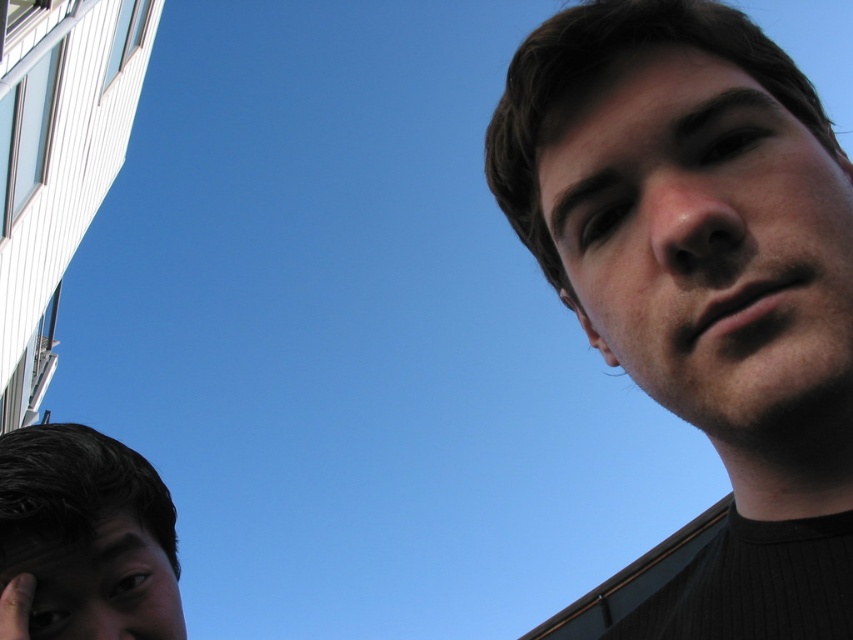
Is smooth skin face at lower left to the right of smooth skin hand at lower left from the viewer's perspective?

Correct, you'll find smooth skin face at lower left to the right of smooth skin hand at lower left.

Which is behind, point (38, 618) or point (4, 618)?

Positioned behind is point (38, 618).

The width and height of the screenshot is (853, 640). I want to click on smooth skin face at lower left, so point(91,586).

Between point (132, 540) and point (564, 285), which one is positioned in front?

Positioned in front is point (132, 540).

Is point (16, 589) positioned before point (570, 296)?

Yes, point (16, 589) is closer to viewer.

Identify the location of smooth skin face at lower left. The height and width of the screenshot is (640, 853). (91, 586).

Which is below, smooth skin face at upper right or matte skin ear at upper right?

Positioned lower is matte skin ear at upper right.

Based on the photo, is the position of smooth skin face at upper right more distant than that of matte skin ear at upper right?

No, smooth skin face at upper right is in front of matte skin ear at upper right.

You are a GUI agent. You are given a task and a screenshot of the screen. Output one action in this format:
    pyautogui.click(x=<x>, y=<y>)
    Task: Click on the smooth skin face at upper right
    This screenshot has width=853, height=640.
    Given the screenshot: What is the action you would take?
    pyautogui.click(x=706, y=241)

Image resolution: width=853 pixels, height=640 pixels. I want to click on smooth skin face at upper right, so click(x=706, y=241).